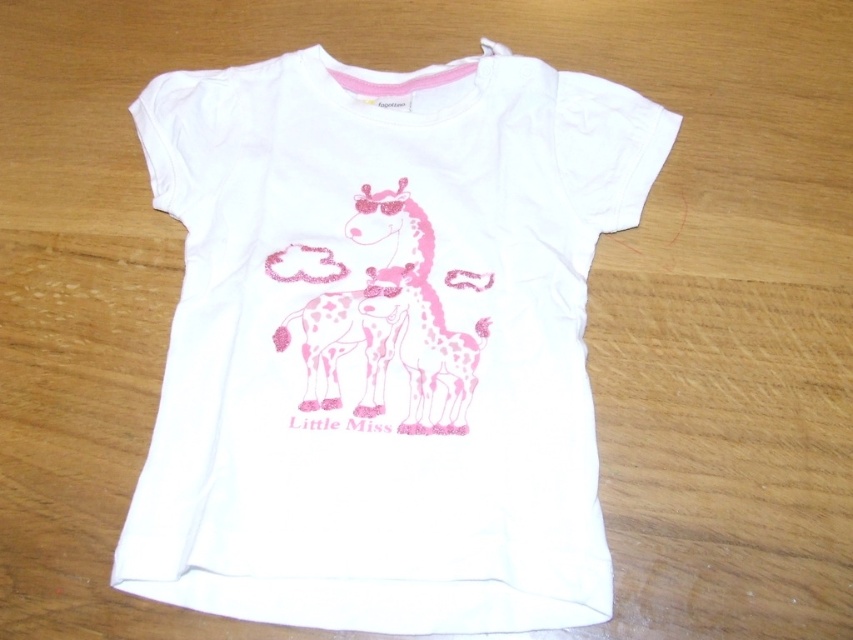
You are holding a camera and want to take a photo of the white t shirt with the giraffe design. The camera is currently positioned 1.28 meters away from the point marked at coordinate point (250, 326). Is this distance suitable for capturing the entire t shirt in the frame?

The point at coordinate point (250, 326) is 1.28 meters from the camera. Since this distance matches the camera position, the entire t shirt should be in frame.